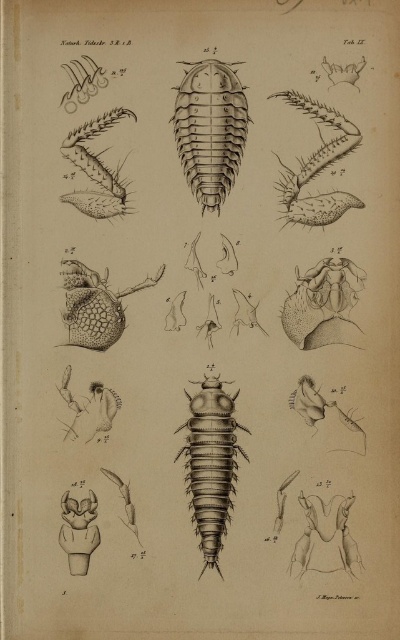
Based on the illustration, if you were to trace a line from the smooth black insect at upper left to the smooth black insect at center, in which direction would the line primarily point?

The line would primarily point to the right since the smooth black insect at center is to the right of the smooth black insect at upper left.

You are an entomologist examining this illustration. You notice two points marked in the image. The first point is at coordinates point (227, 472) and the second is at point (112, 195). Which of these points is closer to the viewer?

Point (227, 472) is in front of point (112, 195), so it is closer to the viewer.

Based on the coordinates provided in the image, where is the smooth black insect at center located?

The smooth black insect at center is located at point (210, 129).